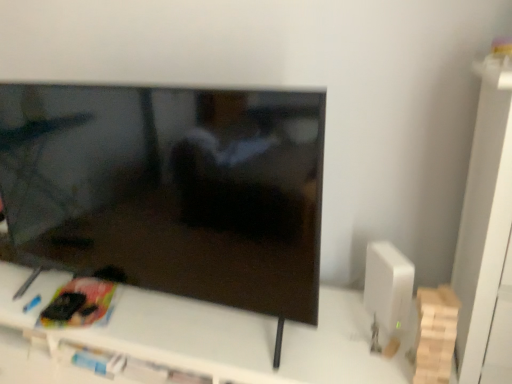
Question: Is white matte cabinet at right looking in the opposite direction of white plastic tv stand at center?

Choices:
 (A) no
 (B) yes

Answer: (A)

Question: Considering the relative sizes of white matte cabinet at right and white plastic tv stand at center in the image provided, is white matte cabinet at right bigger than white plastic tv stand at center?

Choices:
 (A) no
 (B) yes

Answer: (A)

Question: Considering the relative sizes of white matte cabinet at right and white plastic tv stand at center in the image provided, is white matte cabinet at right wider than white plastic tv stand at center?

Choices:
 (A) no
 (B) yes

Answer: (A)

Question: From the image's perspective, is white matte cabinet at right over white plastic tv stand at center?

Choices:
 (A) no
 (B) yes

Answer: (B)

Question: From a real-world perspective, is white matte cabinet at right positioned over white plastic tv stand at center based on gravity?

Choices:
 (A) yes
 (B) no

Answer: (A)

Question: Considering the relative positions of white matte cabinet at right and white plastic tv stand at center in the image provided, is white matte cabinet at right to the right of white plastic tv stand at center from the viewer's perspective?

Choices:
 (A) yes
 (B) no

Answer: (A)

Question: From a real-world perspective, is matte black tv at center on top of white matte cabinet at right?

Choices:
 (A) yes
 (B) no

Answer: (A)

Question: From the image's perspective, would you say matte black tv at center is shown under white matte cabinet at right?

Choices:
 (A) yes
 (B) no

Answer: (B)

Question: Considering the relative sizes of matte black tv at center and white matte cabinet at right in the image provided, is matte black tv at center bigger than white matte cabinet at right?

Choices:
 (A) yes
 (B) no

Answer: (A)

Question: Is white matte cabinet at right at the back of matte black tv at center?

Choices:
 (A) no
 (B) yes

Answer: (A)

Question: Is matte black tv at center thinner than white matte cabinet at right?

Choices:
 (A) yes
 (B) no

Answer: (A)

Question: Is matte black tv at center to the left of white matte cabinet at right from the viewer's perspective?

Choices:
 (A) yes
 (B) no

Answer: (A)

Question: Is white plastic tv stand at center wider than matte black tv at center?

Choices:
 (A) yes
 (B) no

Answer: (A)